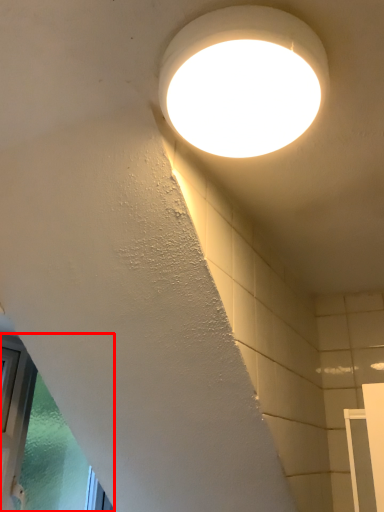
Question: Where is window (annotated by the red box) located in relation to lamp in the image?

Choices:
 (A) right
 (B) left

Answer: (B)